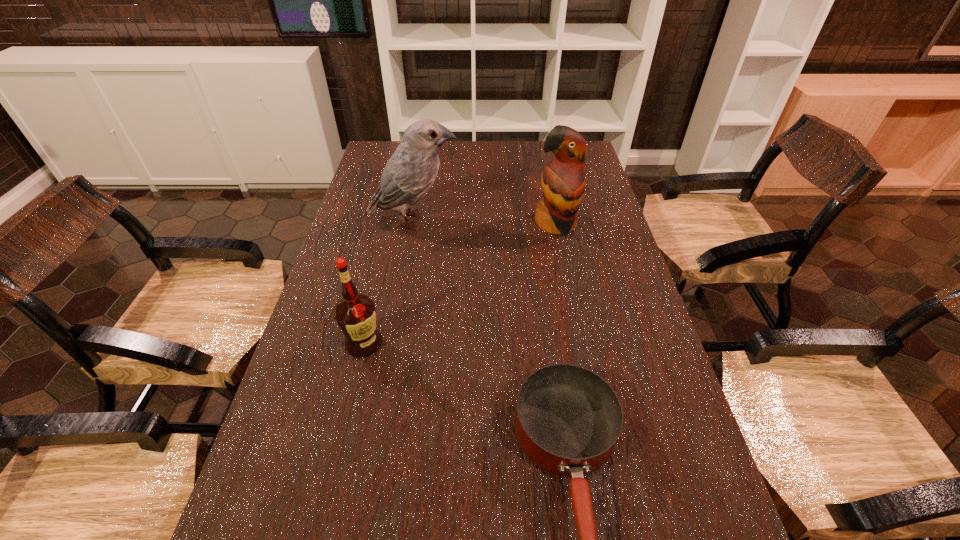
Find the location of `the right parrot`. the right parrot is located at coordinates (563, 181).

Where is `the left parrot`? Image resolution: width=960 pixels, height=540 pixels. the left parrot is located at coordinates (408, 175).

Where is `the third farthest object`? Image resolution: width=960 pixels, height=540 pixels. the third farthest object is located at coordinates (355, 314).

Identify the location of alcohol. This screenshot has width=960, height=540. (355, 314).

At what (x,y) coordinates should I click in order to perform the action: click on free space located on the face of the right parrot. Please return your answer as a coordinate pair (x, y). This screenshot has width=960, height=540. Looking at the image, I should click on (563, 256).

Identify the location of free region located on the front-facing side of the left parrot. This screenshot has height=540, width=960. tap(483, 221).

Identify the location of free space located on the label of the second shortest object. Image resolution: width=960 pixels, height=540 pixels. (319, 535).

You are a GUI agent. You are given a task and a screenshot of the screen. Output one action in this format:
    pyautogui.click(x=<x>, y=<y>)
    Task: Click on the parrot that is positioned at the left edge
    This screenshot has width=960, height=540.
    Given the screenshot: What is the action you would take?
    pyautogui.click(x=408, y=175)

Image resolution: width=960 pixels, height=540 pixels. What are the coordinates of `alcohol located at the left edge` in the screenshot? It's located at (355, 314).

Identify the location of object that is at the right edge. (563, 181).